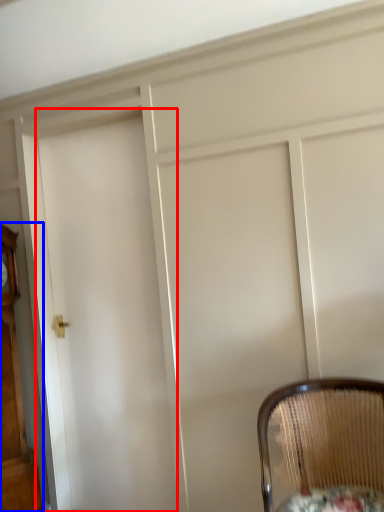
Question: Which point is further to the camera, door (highlighted by a red box) or furniture (highlighted by a blue box)?

Choices:
 (A) door
 (B) furniture

Answer: (A)